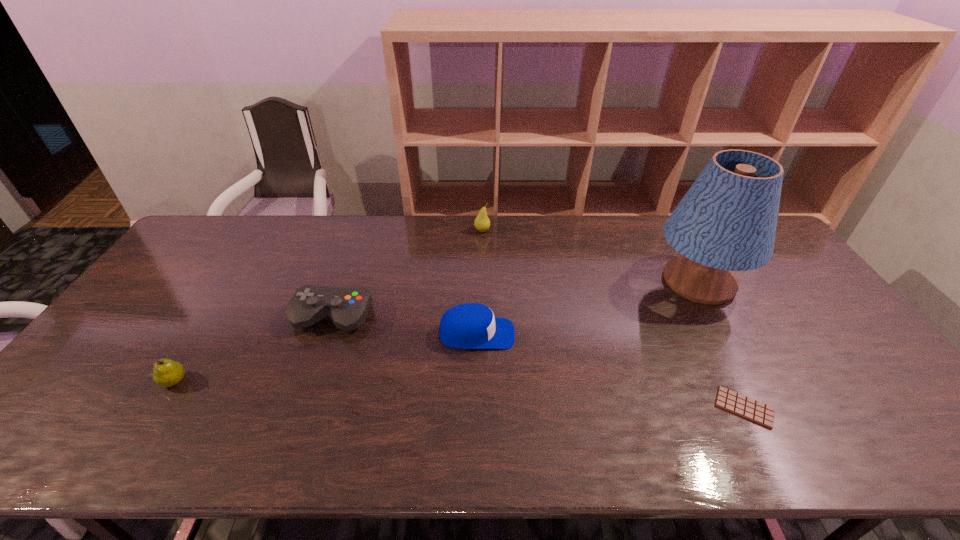
Where is `the tallest object`? the tallest object is located at coordinates (727, 220).

At what (x,y) coordinates should I click in order to perform the action: click on the fifth shortest object. Please return your answer as a coordinate pair (x, y). This screenshot has width=960, height=540. Looking at the image, I should click on (482, 223).

I want to click on the farthest object, so click(482, 223).

The height and width of the screenshot is (540, 960). I want to click on the left pear, so click(x=166, y=372).

Locate an element on the screen. Image resolution: width=960 pixels, height=540 pixels. the leftmost object is located at coordinates (166, 372).

The image size is (960, 540). In order to click on control in this screenshot , I will do `click(347, 307)`.

Find the location of a particular element. The image size is (960, 540). baseball cap is located at coordinates tap(471, 325).

Where is `the shortest object`? The image size is (960, 540). the shortest object is located at coordinates (728, 400).

Find the location of `free space located 0.310m on the left of the lampshade`. free space located 0.310m on the left of the lampshade is located at coordinates [553, 281].

You are a GUI agent. You are given a task and a screenshot of the screen. Output one action in this format:
    pyautogui.click(x=<x>, y=<y>)
    Task: Click on the vacant space situated on the left of the taller pear
    The image size is (960, 540).
    Given the screenshot: What is the action you would take?
    pyautogui.click(x=446, y=231)